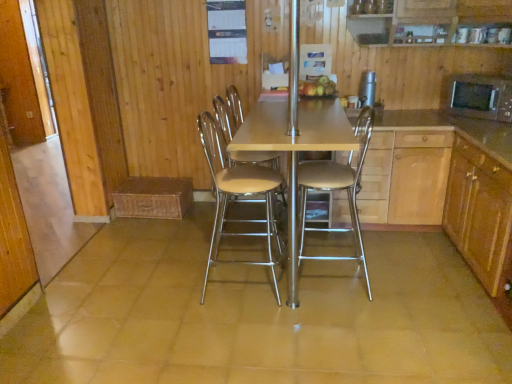
The image size is (512, 384). Identify the location of free point in front of beige leather chair at center, the 2th chair in the right-to-left sequence. (243, 328).